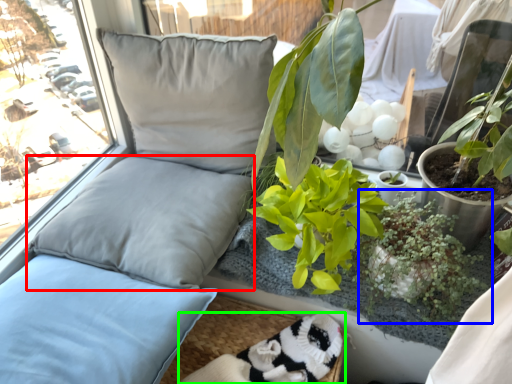
Question: Which object is positioned farthest from pillow (highlighted by a red box)? Select from houseplant (highlighted by a blue box) and wide (highlighted by a green box).

Choices:
 (A) houseplant
 (B) wide

Answer: (A)